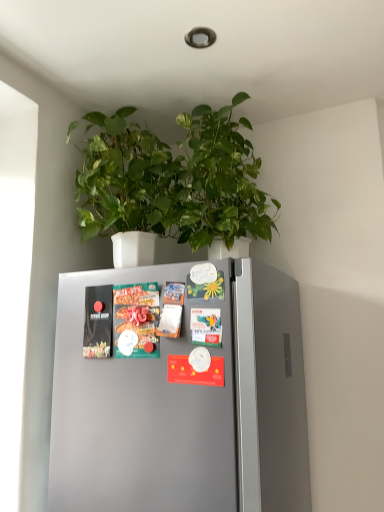
Question: From a real-world perspective, is matte black magazine at left, marked as the first magazine in a left-to-right arrangement, above or below matte plastic magazine at center, the 2th magazine from the left?

Choices:
 (A) below
 (B) above

Answer: (B)

Question: Considering the relative positions of matte black magazine at left, placed as the second magazine when sorted from right to left, and matte plastic magazine at center, which is the first magazine in right-to-left order, in the image provided, is matte black magazine at left, placed as the second magazine when sorted from right to left, to the left or to the right of matte plastic magazine at center, which is the first magazine in right-to-left order,?

Choices:
 (A) left
 (B) right

Answer: (A)

Question: Estimate the real-world distances between objects in this image. Which object is closer to the matte plastic magazine at center, the 2th magazine from the left?

Choices:
 (A) green glossy leaves at upper center
 (B) matte black magazine at left, marked as the first magazine in a left-to-right arrangement

Answer: (B)

Question: Considering the real-world distances, which object is farthest from the matte black magazine at left, placed as the second magazine when sorted from right to left?

Choices:
 (A) green glossy leaves at upper center
 (B) matte plastic magazine at center, which is the first magazine in right-to-left order

Answer: (A)